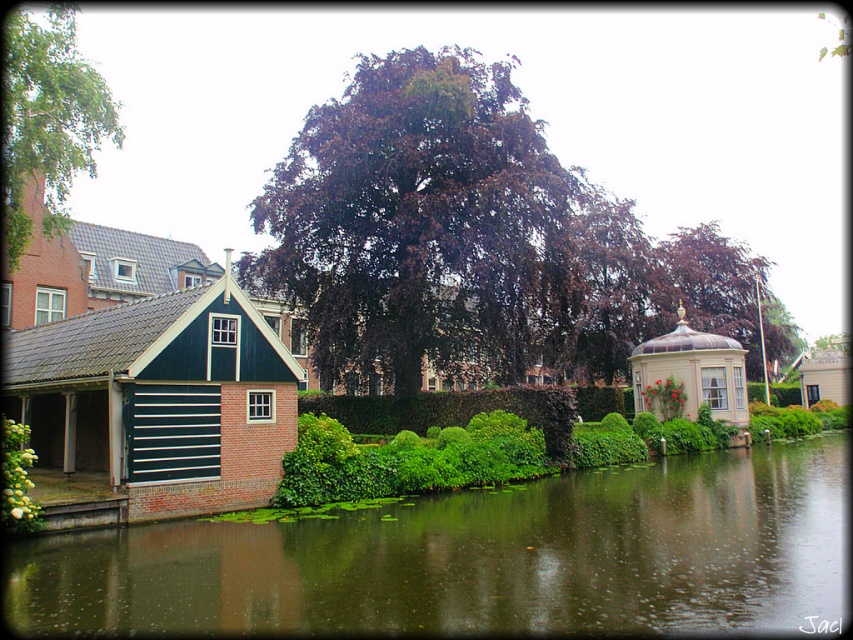
You are standing on a wooden dock near the canal and want to place a small potted plant between the green reflective water at lower center and the white fluffy bush at lower left. Based on their positions, which object should the potted plant be closer to?

The green reflective water at lower center is below the white fluffy bush at lower left, so the potted plant should be placed closer to the white fluffy bush at lower left to maintain the vertical arrangement between them.

You are a tourist standing on the canal side and want to take a photo of the green reflective water at lower center and the dark purple leafy tree at center. Which object will appear closer to the camera in the photo?

The dark purple leafy tree at center will appear closer to the camera in the photo because it is taller than the green reflective water at lower center.

From the picture: You are standing on a bridge overlooking the canal and want to place a small boat in the green reflective water at lower center. To ensure the boat stays in place, you need to know if the dark purple leafy tree at center is casting a shadow over the water. Can you determine this based on the scene?

The green reflective water at lower center is located below the dark purple leafy tree at center, so the tree is directly above the water. This means the tree could cast a shadow over the water, depending on the time of day and sunlight direction, but the scene description does not provide explicit information about shadows. However, since the tree is positioned above the water, it is possible that the tree does cast a shadow over the green reflective water at lower center.